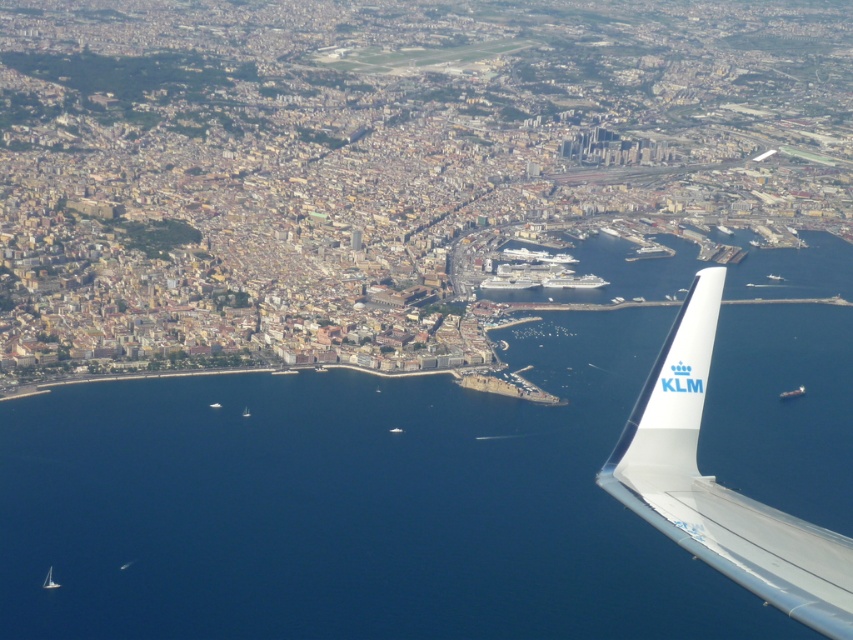
Does white glossy cruise ship at center have a greater width compared to white plastic boat at lower center?

Correct, the width of white glossy cruise ship at center exceeds that of white plastic boat at lower center.

Is white glossy cruise ship at center further to camera compared to white plastic boat at lower center?

No, white glossy cruise ship at center is in front of white plastic boat at lower center.

The height and width of the screenshot is (640, 853). Describe the element at coordinates (573, 280) in the screenshot. I see `white glossy cruise ship at center` at that location.

Find the location of a particular element. This screenshot has height=640, width=853. white glossy cruise ship at center is located at coordinates (573, 280).

Which is more to the left, white metallic wing at right or white glossy wing at lower right?

Positioned to the left is white metallic wing at right.

Measure the distance between white metallic wing at right and white glossy wing at lower right.

The distance of white metallic wing at right from white glossy wing at lower right is 6.73 meters.

Is point (677, 362) closer to viewer compared to point (799, 579)?

Yes, it is in front of point (799, 579).

Locate an element on the screen. Image resolution: width=853 pixels, height=640 pixels. white metallic wing at right is located at coordinates (720, 484).

Does metallic silver boat at lower right come in front of white matte sailboat at lower left?

Yes, metallic silver boat at lower right is closer to the viewer.

Which is in front, point (802, 388) or point (47, 572)?

Positioned in front is point (802, 388).

At what (x,y) coordinates should I click in order to perform the action: click on metallic silver boat at lower right. Please return your answer as a coordinate pair (x, y). Looking at the image, I should click on (x=792, y=392).